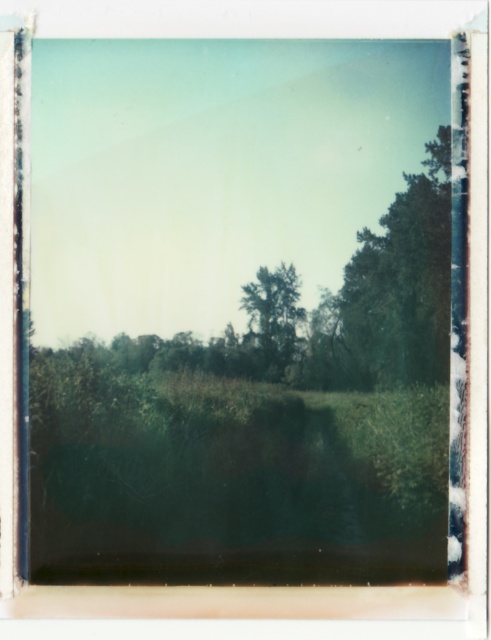
Which is above, green leafy tree at upper right or green leafy tree at center?

green leafy tree at upper right is higher up.

Does green leafy tree at upper right have a greater width compared to green leafy tree at center?

Correct, the width of green leafy tree at upper right exceeds that of green leafy tree at center.

The image size is (491, 640). Describe the element at coordinates (391, 292) in the screenshot. I see `green leafy tree at upper right` at that location.

The image size is (491, 640). Find the location of `green leafy tree at upper right`. green leafy tree at upper right is located at coordinates (391, 292).